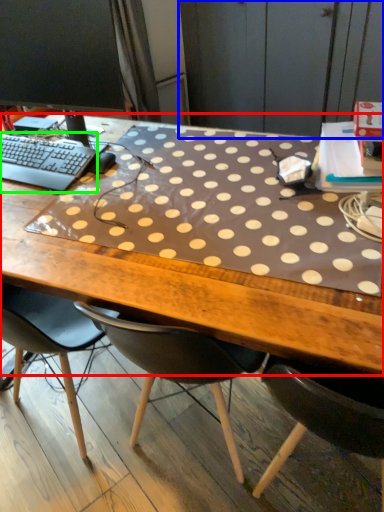
Question: Estimate the real-world distances between objects in this image. Which object is farther from desk (highlighted by a red box), dresser (highlighted by a blue box) or computer keyboard (highlighted by a green box)?

Choices:
 (A) dresser
 (B) computer keyboard

Answer: (A)